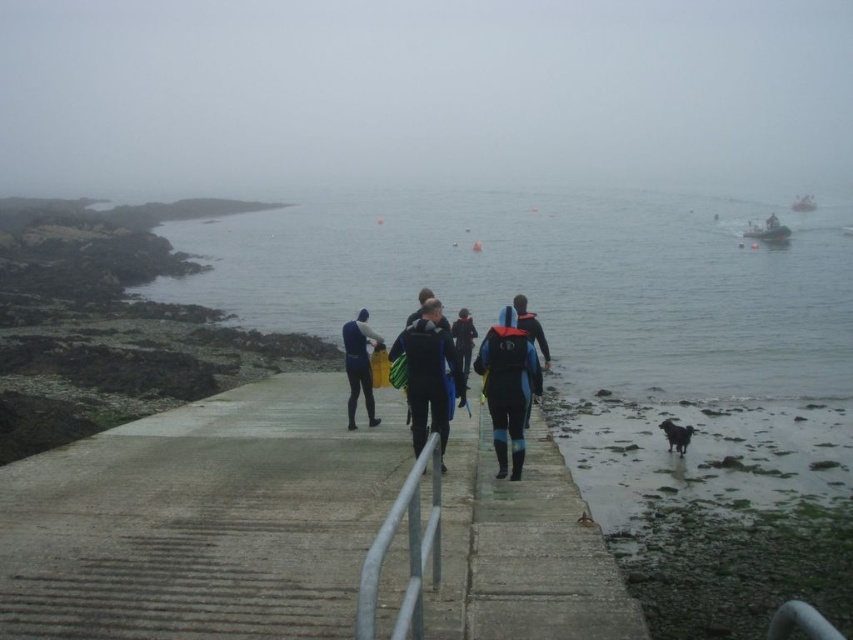
Question: Is silver metallic rail at center below matte black wetsuit at center?

Choices:
 (A) no
 (B) yes

Answer: (B)

Question: Is blue wetsuit at center closer to camera compared to matte black wetsuit at center?

Choices:
 (A) yes
 (B) no

Answer: (A)

Question: Which of the following is the closest to the observer?

Choices:
 (A) (x=529, y=371)
 (B) (x=375, y=340)
 (C) (x=451, y=348)

Answer: (A)

Question: Estimate the real-world distances between objects in this image. Which object is closer to the clear water at center?

Choices:
 (A) silver metallic rail at center
 (B) matte black wetsuit at center
 (C) black wetsuit at center
 (D) concrete at center

Answer: (D)

Question: Is blue matte wetsuit at center smaller than matte black wetsuit at center?

Choices:
 (A) yes
 (B) no

Answer: (A)

Question: Which point is farther to the camera?

Choices:
 (A) (373, 516)
 (B) (363, 333)

Answer: (B)